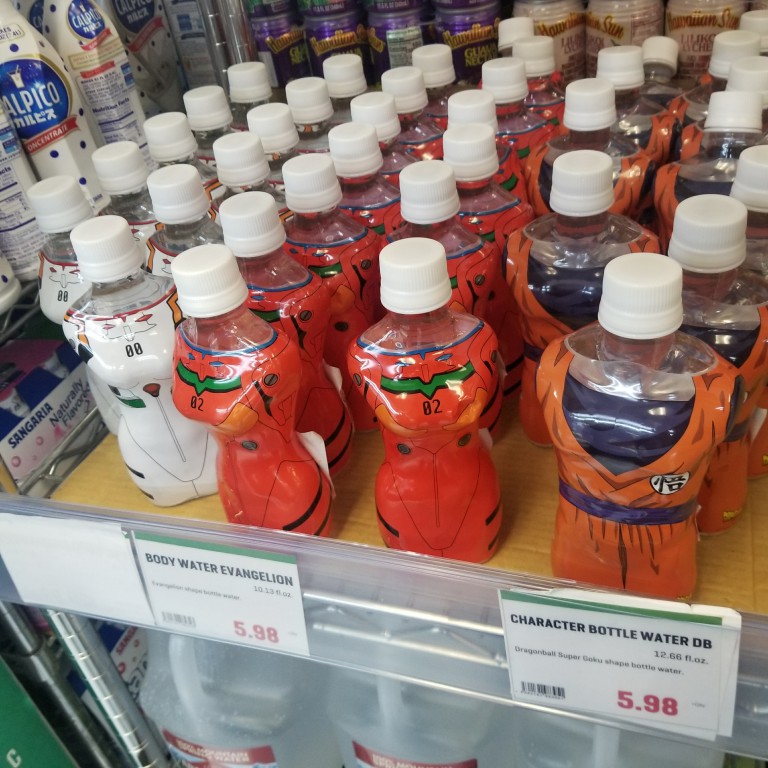
The width and height of the screenshot is (768, 768). I want to click on bottles, so click(415, 422), click(255, 429), click(611, 435), click(270, 719), click(154, 353).